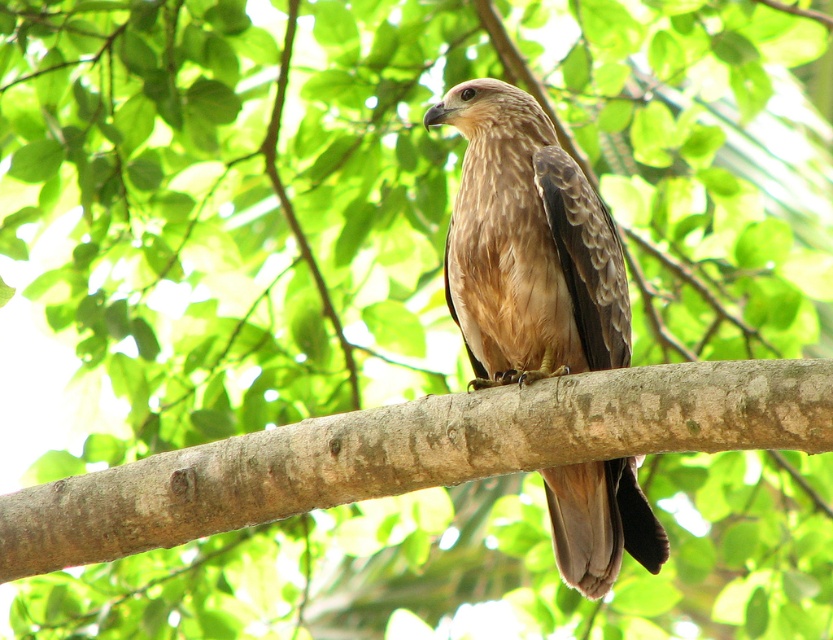
Question: Can you confirm if brown rough tree branch at center is thinner than brown feathered eagle at center?

Choices:
 (A) no
 (B) yes

Answer: (A)

Question: Considering the relative positions of brown rough tree branch at center and brown feathered eagle at center in the image provided, where is brown rough tree branch at center located with respect to brown feathered eagle at center?

Choices:
 (A) right
 (B) left

Answer: (B)

Question: From the image, what is the correct spatial relationship of brown rough tree branch at center in relation to brown feathered eagle at center?

Choices:
 (A) below
 (B) above

Answer: (A)

Question: Which object appears farthest from the camera in this image?

Choices:
 (A) brown feathered eagle at center
 (B) brown rough tree branch at center

Answer: (A)